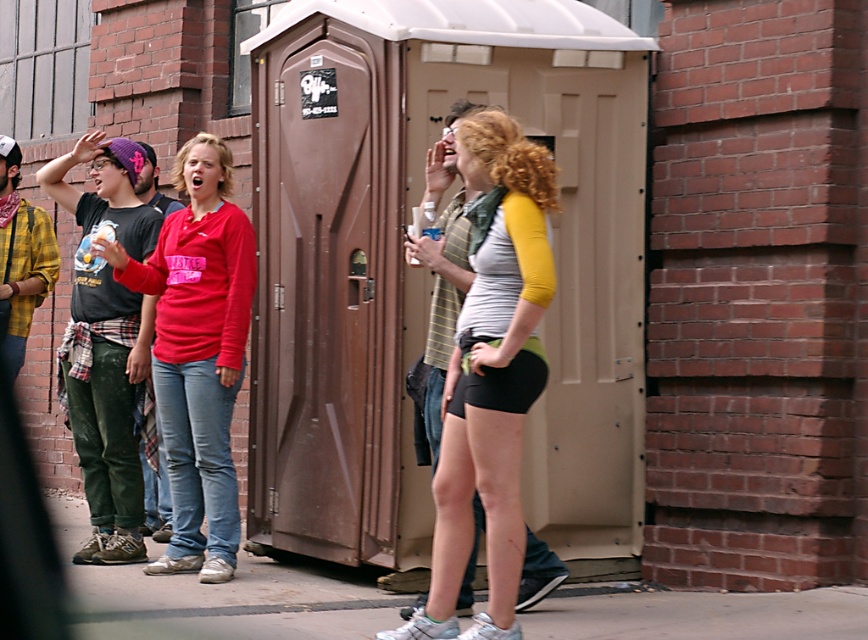
Who is more distant from viewer, (495, 342) or (189, 369)?

Positioned behind is point (189, 369).

Does matte gray shorts at center have a larger size compared to matte red shirt at center?

No.

This screenshot has width=868, height=640. Find the location of `matte gray shorts at center`. matte gray shorts at center is located at coordinates (490, 376).